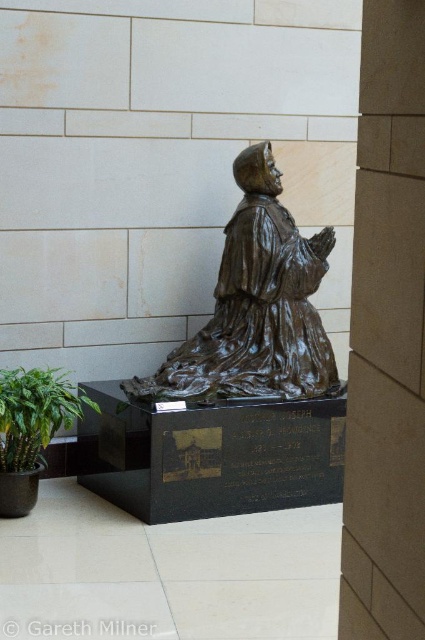
Is point (382, 221) closer to viewer compared to point (138, 388)?

Yes, it is in front of point (138, 388).

Can you confirm if brown stone pillar at center is bigger than bronze statue at center?

No, brown stone pillar at center is not bigger than bronze statue at center.

Does point (416, 252) come closer to viewer compared to point (272, 301)?

Yes, point (416, 252) is in front of point (272, 301).

Where is `brown stone pillar at center`? brown stone pillar at center is located at coordinates (387, 337).